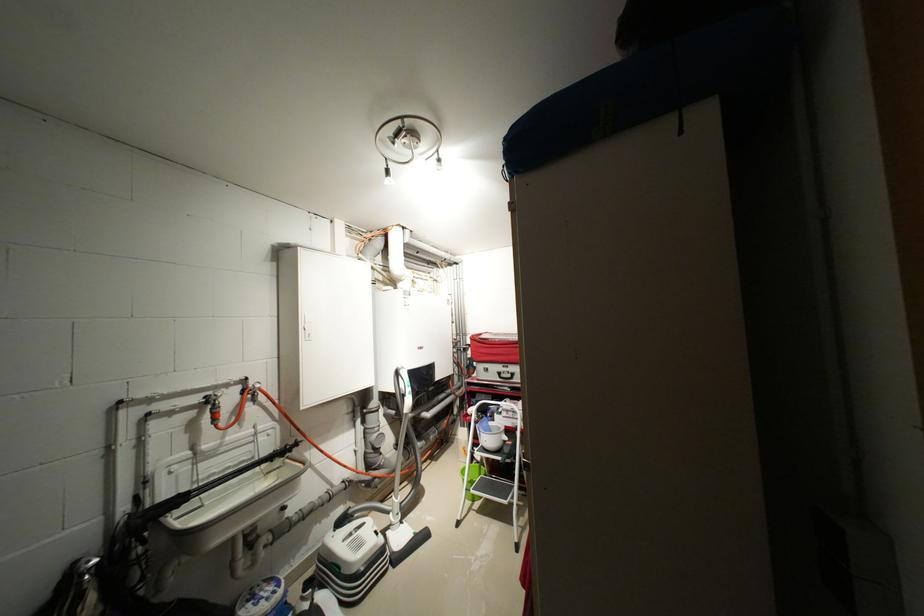
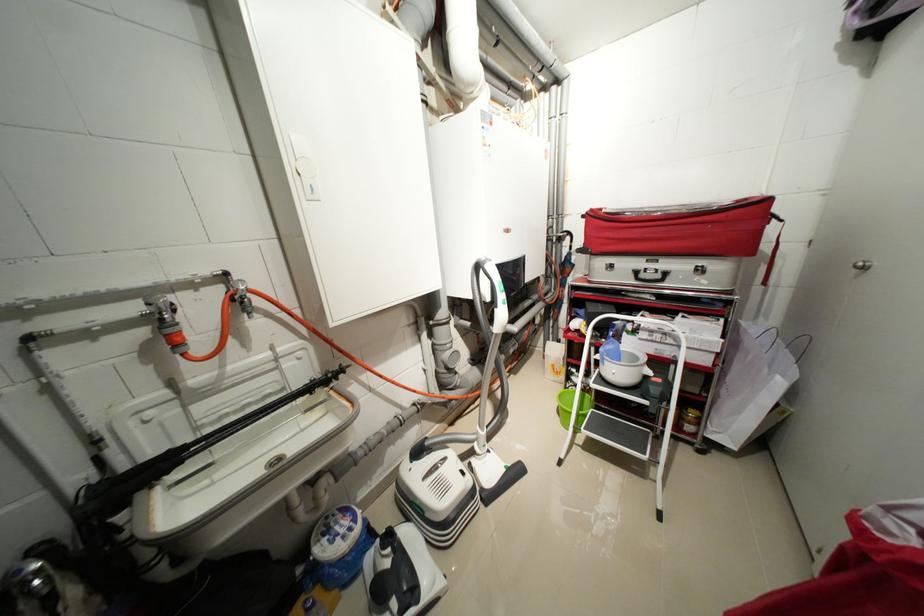
What movement of the cameraman would produce the second image?

The cameraman moved toward left, forward.